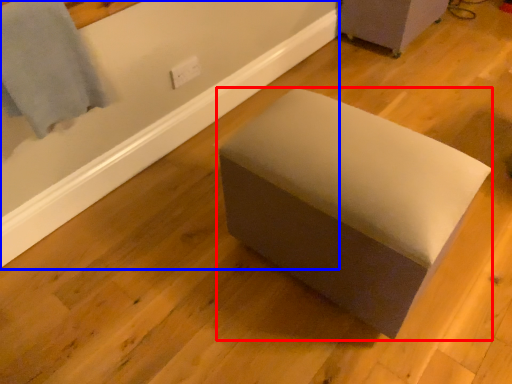
Question: Among these objects, which one is farthest to the camera, furniture (highlighted by a red box) or bath (highlighted by a blue box)?

Choices:
 (A) furniture
 (B) bath

Answer: (B)